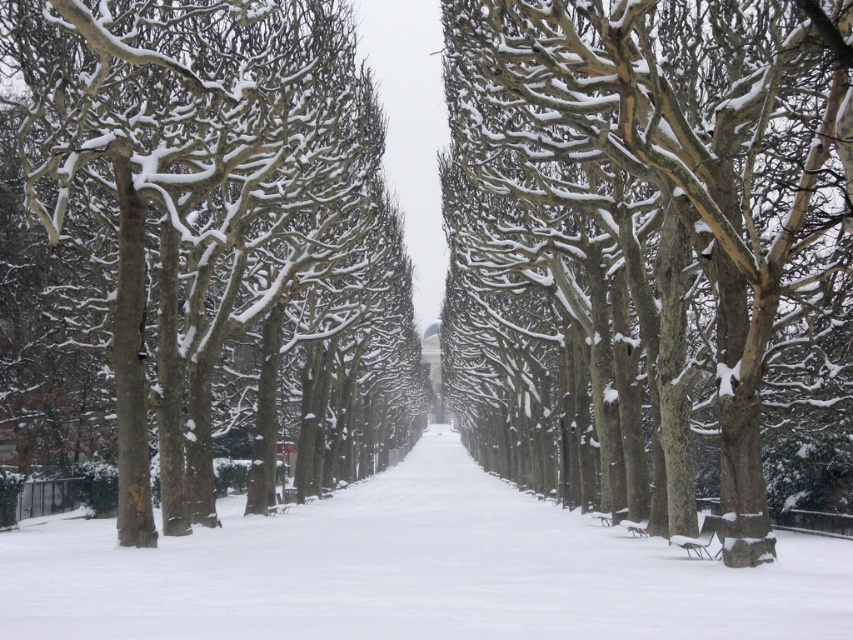
Question: Which point appears closest to the camera in this image?

Choices:
 (A) (824, 28)
 (B) (194, 182)
 (C) (717, 556)
 (D) (134, 570)

Answer: (A)

Question: Which object is closer to the camera taking this photo?

Choices:
 (A) white snow-covered pavement at center
 (B) snow-covered bark trees at center
 (C) smooth bark trees at center

Answer: (A)

Question: Which point appears closest to the camera in this image?

Choices:
 (A) (65, 296)
 (B) (486, 80)
 (C) (688, 544)
 (D) (592, 598)

Answer: (D)

Question: Can you confirm if snow-covered bark trees at center is positioned above smooth bark trees at center?

Choices:
 (A) yes
 (B) no

Answer: (B)

Question: Does snow-covered bark trees at center come in front of wooden park bench at center?

Choices:
 (A) no
 (B) yes

Answer: (B)

Question: Can you confirm if white snow-covered pavement at center is bigger than wooden park bench at center?

Choices:
 (A) no
 (B) yes

Answer: (B)